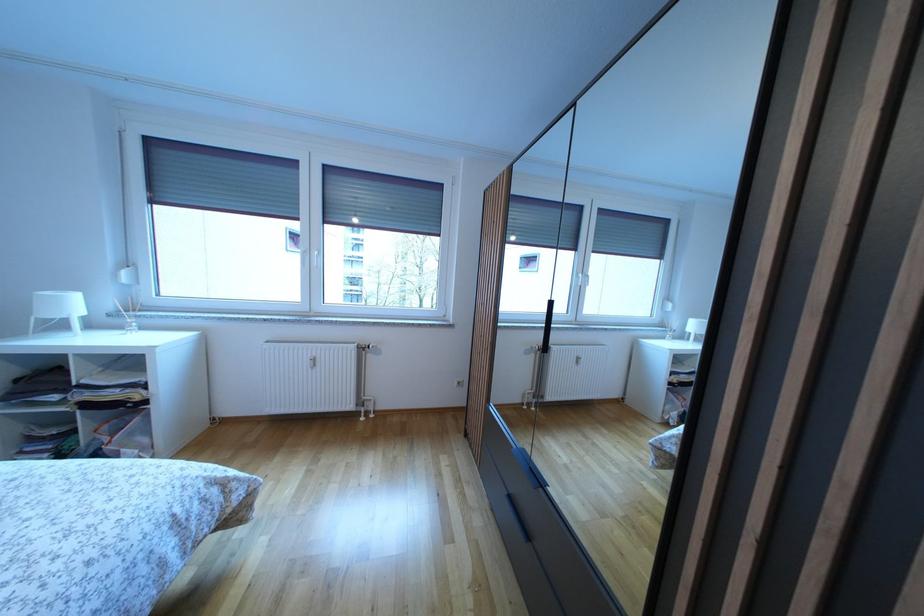
The image size is (924, 616). Identify the location of white window handle. (315, 259).